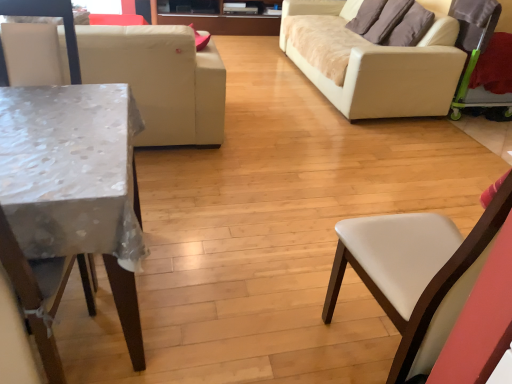
Question: Is wooden entertainment center at upper center not inside white leather chair at right, which is the 1th chair in right-to-left order?

Choices:
 (A) no
 (B) yes

Answer: (B)

Question: Is wooden entertainment center at upper center shorter than white leather chair at right, which is the 1th chair in right-to-left order?

Choices:
 (A) no
 (B) yes

Answer: (B)

Question: Does wooden entertainment center at upper center touch white leather chair at right, the second chair from the left?

Choices:
 (A) yes
 (B) no

Answer: (B)

Question: Does wooden entertainment center at upper center have a smaller size compared to white leather chair at right, the second chair from the left?

Choices:
 (A) no
 (B) yes

Answer: (A)

Question: Does wooden entertainment center at upper center have a greater height compared to white leather chair at right, the second chair from the left?

Choices:
 (A) yes
 (B) no

Answer: (B)

Question: Is wooden entertainment center at upper center situated inside white leather chair at left, marked as the 2th chair in a right-to-left arrangement, or outside?

Choices:
 (A) outside
 (B) inside

Answer: (A)

Question: From the image's perspective, relative to white leather chair at left, marked as the 2th chair in a right-to-left arrangement, is wooden entertainment center at upper center above or below?

Choices:
 (A) below
 (B) above

Answer: (B)

Question: Is point (261, 28) positioned closer to the camera than point (6, 77)?

Choices:
 (A) farther
 (B) closer

Answer: (A)

Question: In terms of height, does wooden entertainment center at upper center look taller or shorter compared to white leather chair at left, marked as the 2th chair in a right-to-left arrangement?

Choices:
 (A) short
 (B) tall

Answer: (A)

Question: Based on their sizes in the image, would you say wooden entertainment center at upper center is bigger or smaller than white leather chair at right, the second chair from the left?

Choices:
 (A) big
 (B) small

Answer: (A)

Question: Do you think wooden entertainment center at upper center is within white leather chair at right, the second chair from the left, or outside of it?

Choices:
 (A) outside
 (B) inside

Answer: (A)

Question: Considering the relative positions of wooden entertainment center at upper center and white leather chair at right, which is the 1th chair in right-to-left order, in the image provided, is wooden entertainment center at upper center to the left or to the right of white leather chair at right, which is the 1th chair in right-to-left order,?

Choices:
 (A) right
 (B) left

Answer: (B)

Question: From a real-world perspective, relative to white leather chair at right, which is the 1th chair in right-to-left order, is wooden entertainment center at upper center vertically above or below?

Choices:
 (A) below
 (B) above

Answer: (A)

Question: In terms of size, does beige fabric studio couch at right, placed as the 1th studio couch when sorted from right to left, appear bigger or smaller than white leather couch at left, placed as the 2th studio couch when sorted from right to left?

Choices:
 (A) big
 (B) small

Answer: (A)

Question: Considering the positions of point (402, 49) and point (194, 102), is point (402, 49) closer or farther from the camera than point (194, 102)?

Choices:
 (A) farther
 (B) closer

Answer: (A)